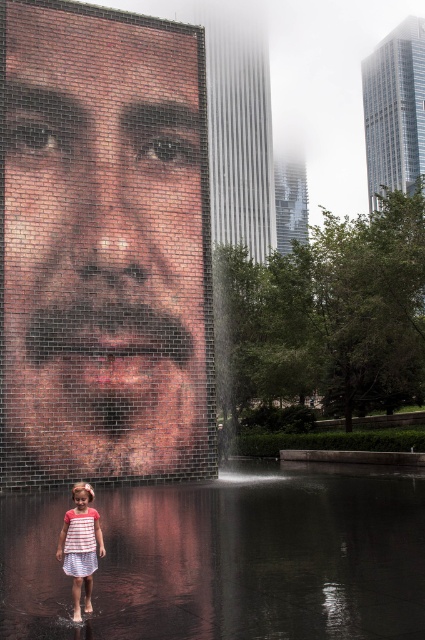
You are a photographer standing at the center of the scene. You want to take a photo of the brick mosaic face at center. Where should you aim your camera to capture it?

You should aim your camera at point (104, 244) to capture the brick mosaic face at center.

You are a photographer trying to capture a shot of the brick mosaic face at center and the white striped dress at lower left. Based on their positions, which object should you frame first in your camera viewfinder to ensure both are in the shot?

The brick mosaic face at center is to the left of white striped dress at lower left, so you should frame the brick mosaic face at center first to ensure both are included in the shot.

What are the coordinates of the brick mosaic face at center?

The brick mosaic face at center is located at point (x=104, y=244).